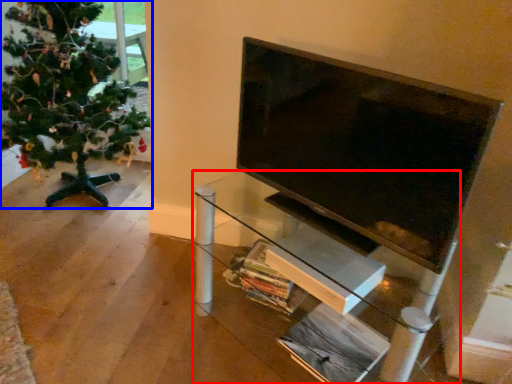
Question: Which object appears closest to the camera in this image, furniture (highlighted by a red box) or christmas tree (highlighted by a blue box)?

Choices:
 (A) furniture
 (B) christmas tree

Answer: (A)